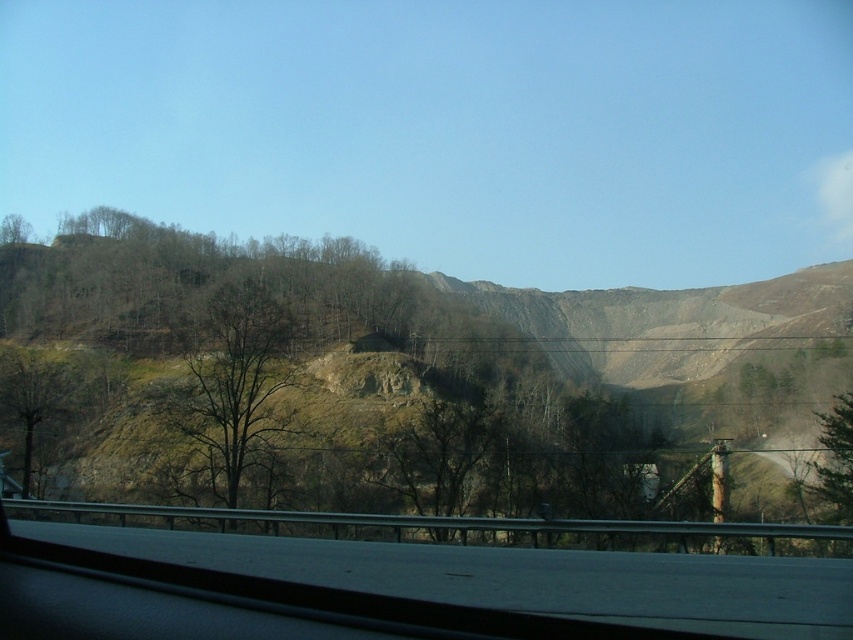
Question: Does green leafy tree at center appear on the left side of green leafy tree at lower left?

Choices:
 (A) no
 (B) yes

Answer: (A)

Question: Estimate the real-world distances between objects in this image. Which object is closer to the green leafy tree at center?

Choices:
 (A) green leafy tree at lower left
 (B) green leafy tree at upper left

Answer: (A)

Question: Can you confirm if green leafy tree at center is positioned to the right of green leafy tree at upper left?

Choices:
 (A) yes
 (B) no

Answer: (A)

Question: Is green leafy tree at center thinner than green leafy tree at lower left?

Choices:
 (A) yes
 (B) no

Answer: (A)

Question: Which of the following is the closest to the observer?

Choices:
 (A) green leafy tree at center
 (B) green leafy tree at upper left
 (C) green leafy tree at lower left

Answer: (A)

Question: Which point is closer to the camera?

Choices:
 (A) (219, 364)
 (B) (0, 403)
 (C) (4, 234)

Answer: (A)